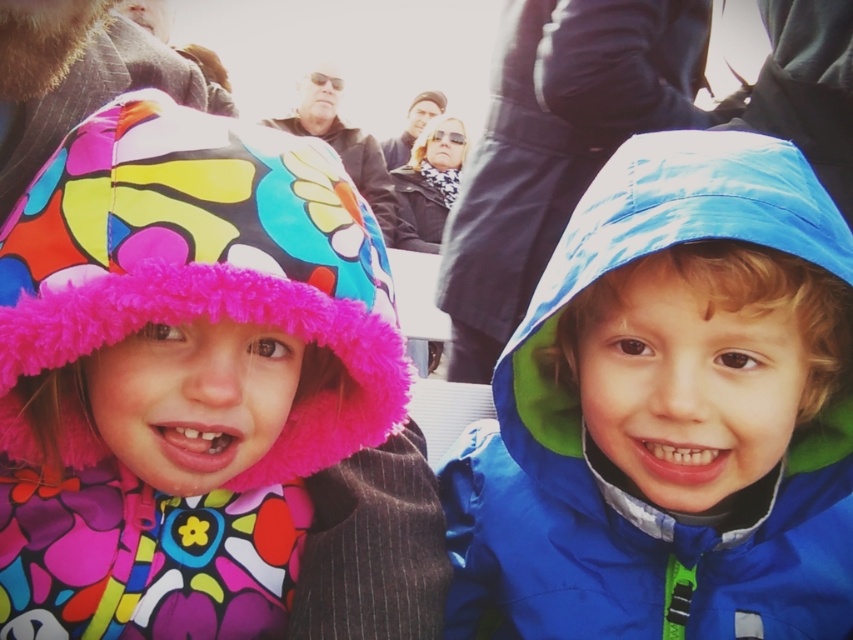
You are a photographer trying to capture a clear shot of the blue shiny raincoat at center and the matte black hat at upper center. Since you want to focus on the raincoat, which object should you adjust your camera lens to prioritize in terms of size in the frame?

The blue shiny raincoat at center has a greater height compared to the matte black hat at upper center, so you should adjust your camera lens to prioritize the blue shiny raincoat at center as it is taller and will naturally appear larger in the frame.

You are trying to decide which item to pack for a trip. You have a bag with a width limit of 30 cm. The blue waterproof jacket at center and the multicolored fleece hat at left are both in your options. Based on their sizes, which item is more likely to fit in your bag?

The multicolored fleece hat at left is more likely to fit in the bag since the blue waterproof jacket at center might be wider than it, exceeding the 30 cm width limit.

You are standing in a cold outdoor event and see the blue waterproof jacket at center and the multicolored fleece hat at left. Which one is positioned to the right side?

The blue waterproof jacket at center is positioned to the right of the multicolored fleece hat at left.